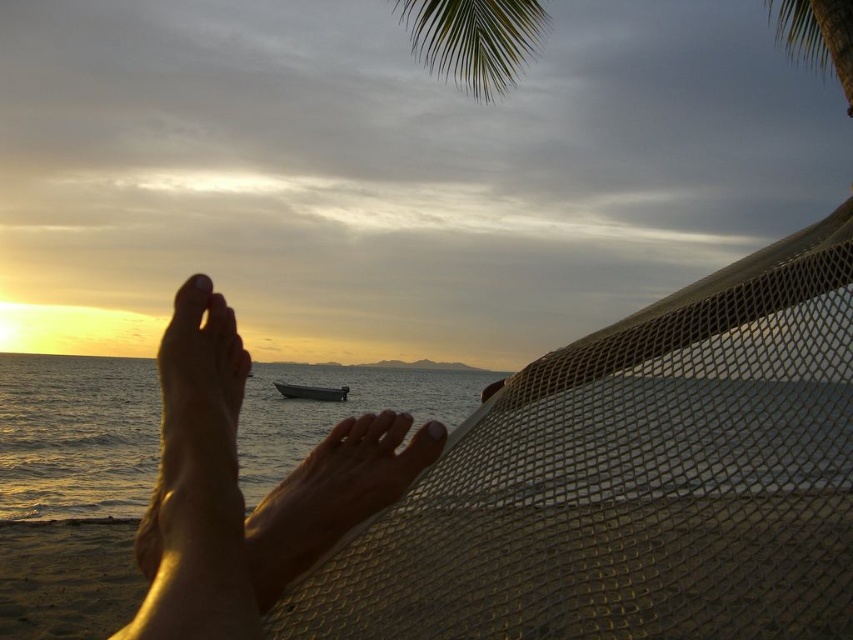
Which is more to the right, matte skin foot at lower left or dark gray matte boat at center?

matte skin foot at lower left

Can you confirm if matte skin foot at lower left is thinner than dark gray matte boat at center?

Indeed, matte skin foot at lower left has a lesser width compared to dark gray matte boat at center.

Who is more distant from viewer, (192, 372) or (312, 396)?

Positioned behind is point (312, 396).

I want to click on matte skin foot at lower left, so click(x=196, y=408).

Does green leafy palm at upper center have a larger size compared to green leafy palm tree at upper right?

Correct, green leafy palm at upper center is larger in size than green leafy palm tree at upper right.

Who is more distant from viewer, (436, 26) or (788, 54)?

The point (788, 54) is more distant.

Which is in front, point (477, 45) or point (807, 26)?

Point (477, 45)

Identify the location of green leafy palm at upper center. (473, 38).

Which is below, golden water at lower left or green leafy palm at upper center?

golden water at lower left

Locate an element on the screen. The image size is (853, 640). golden water at lower left is located at coordinates (74, 435).

Identify the location of golden water at lower left. The height and width of the screenshot is (640, 853). 74,435.